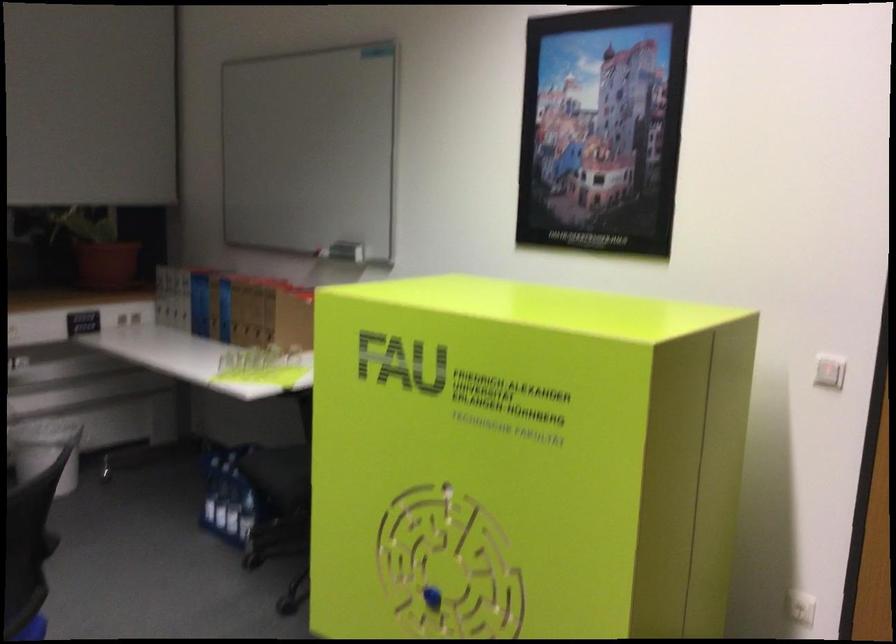
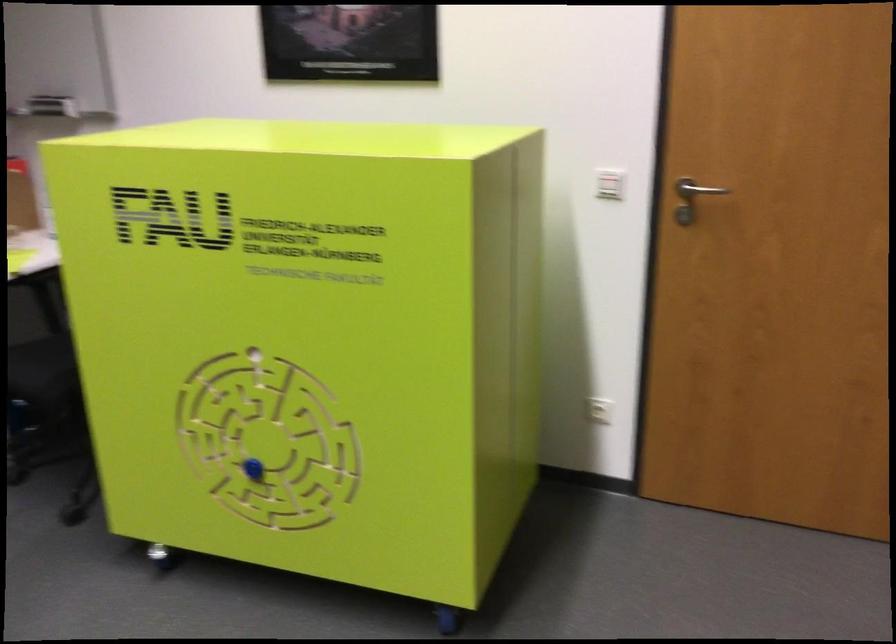
Question: The camera is either moving clockwise (left) or counter-clockwise (right) around the object. The first image is from the beginning of the video and the second image is from the end. Is the camera moving left or right when shooting the video?

Choices:
 (A) Left
 (B) Right

Answer: (A)